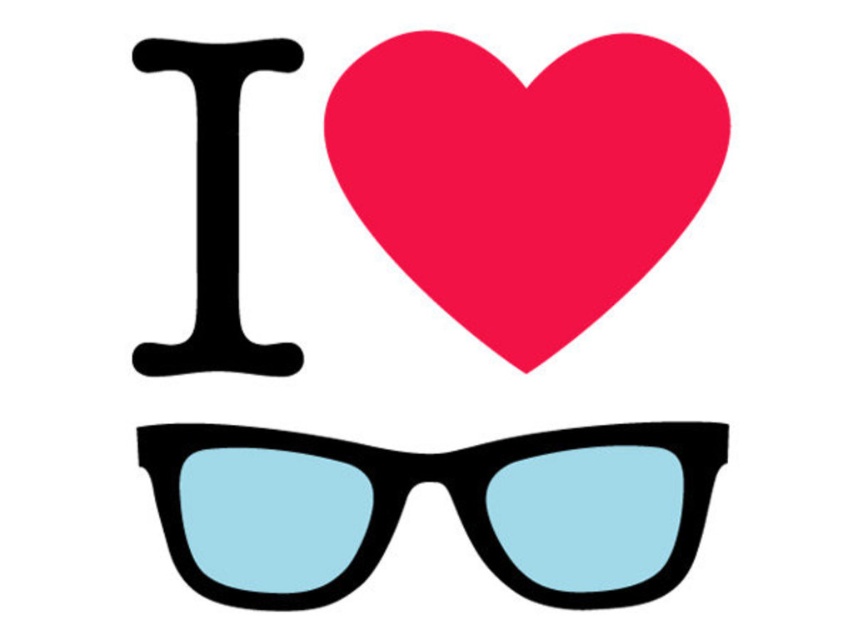
Which is above, matte red heart at center or matte black sunglasses at center?

Positioned higher is matte red heart at center.

Who is more distant from viewer, (560, 84) or (381, 481)?

Point (560, 84)

Is point (399, 262) positioned before point (370, 449)?

No, it is not.

The width and height of the screenshot is (853, 640). What are the coordinates of `matte red heart at center` in the screenshot? It's located at (525, 173).